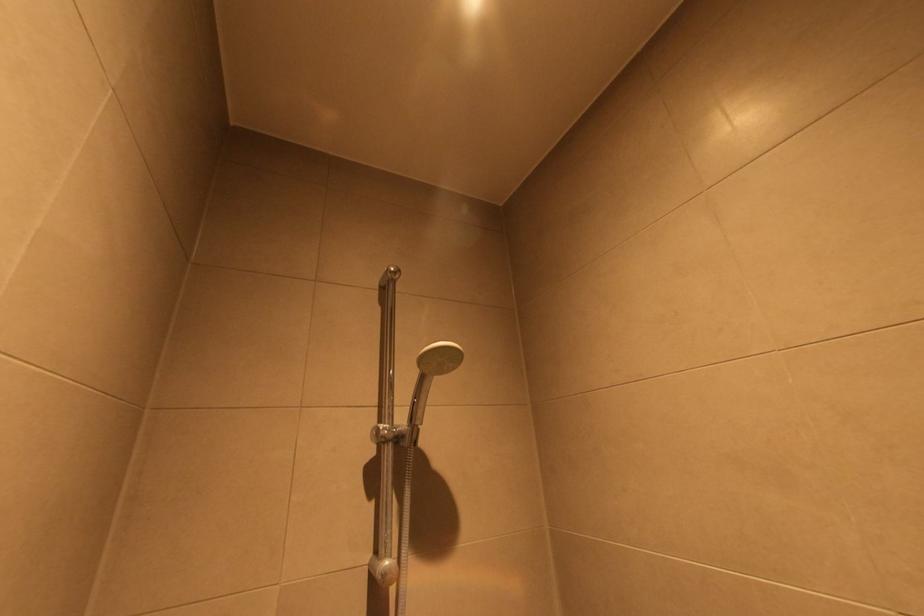
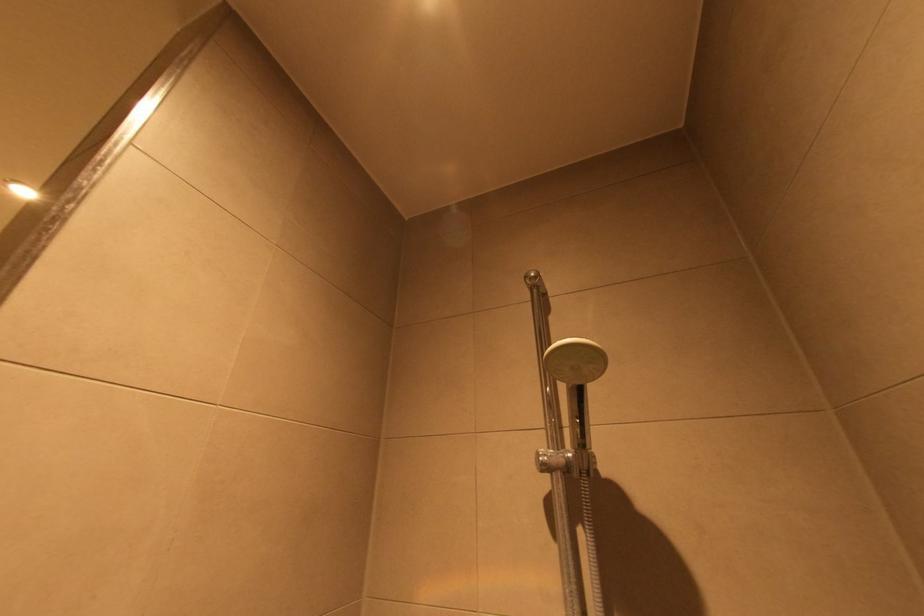
Question: The images are taken continuously from a first-person perspective. In which direction is your viewpoint rotating?

Choices:
 (A) Left
 (B) Right
 (C) Up
 (D) Down

Answer: (A)